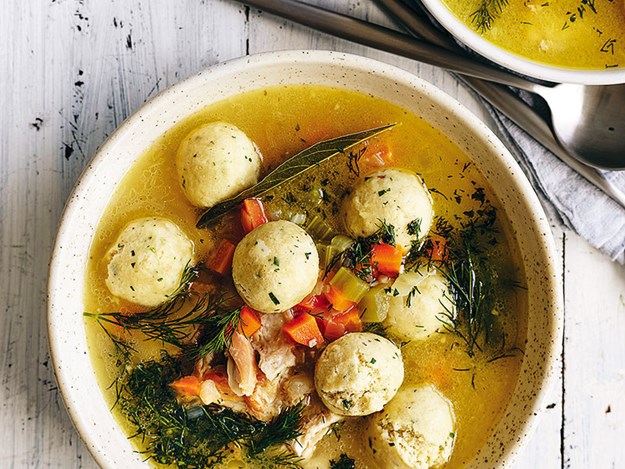
Find the location of a particular element. This screenshot has width=625, height=469. place to hold spoon is located at coordinates (291, 10), (358, 32).